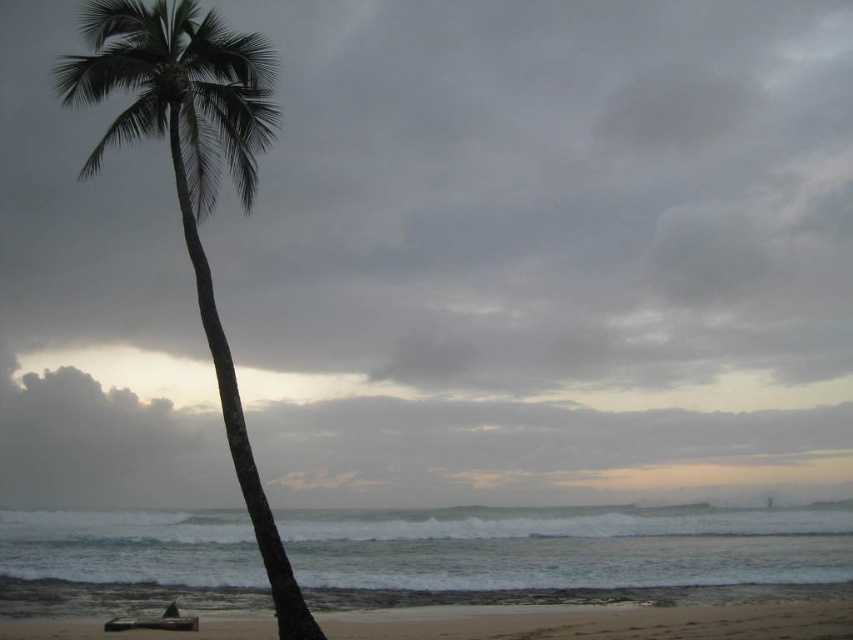
You are planning to place a small bench on the beige sandy beach at lower center. Considering the space available, will the bench fit if it is as wide as the green leafy palm tree at left?

The green leafy palm tree at left is wider than the beige sandy beach at lower center, so placing a bench as wide as the palm tree might not fit on the beach area since the beach is narrower.

You are a photographer trying to capture the palm tree and the beach in a single shot. Since the green leafy palm tree at left and the beige sandy beach at lower center are in your viewfinder, which one will appear bigger in the photo?

The green leafy palm tree at left will appear bigger in the photo because it has a larger size compared to the beige sandy beach at lower center.

You are a bird flying over the beach scene. You want to land on the tallest object in the image. Which object should you choose between the green leafy palm tree at left and the beige sandy beach at lower center?

The green leafy palm tree at left is much taller than the beige sandy beach at lower center, so you should land on the green leafy palm tree at left.